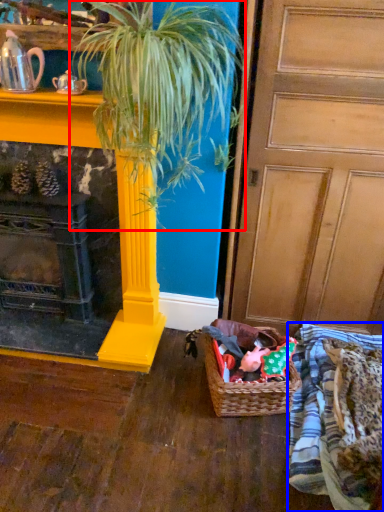
Question: Which object appears closest to the camera in this image, houseplant (highlighted by a red box) or clothing (highlighted by a blue box)?

Choices:
 (A) houseplant
 (B) clothing

Answer: (A)